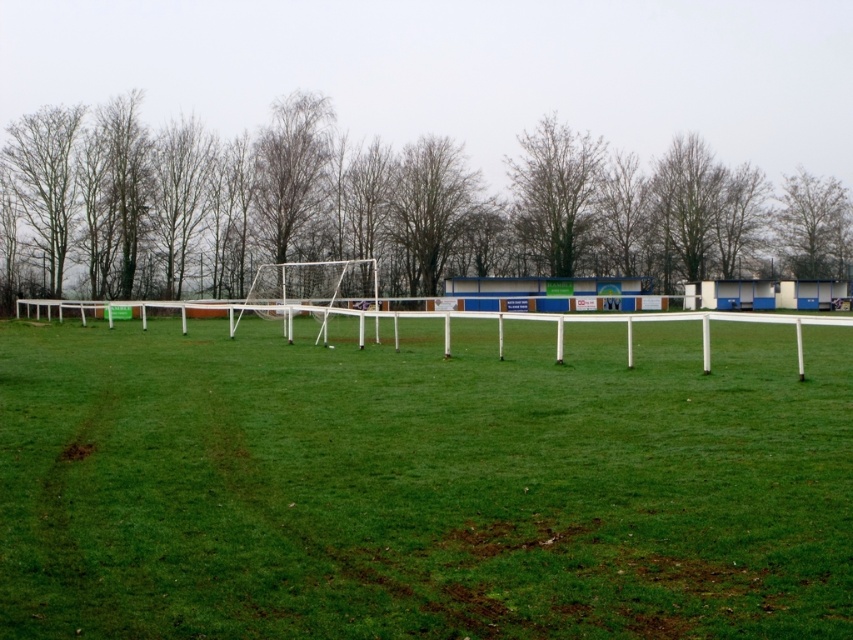
You are an architect designing a new sports field and want to incorporate the existing brown leafless tree at upper left and bare branches at upper right into the design. Which of the two should you prioritize preserving due to its size?

The brown leafless tree at upper left should be prioritized for preservation because its width is larger than the bare branches at upper right.

You are standing at the center of the soccer field and see a point marked at coordinates (383,209). Based on the scene description, what object is located at this point?

The point at coordinates (383,209) is located on a brown leafless tree at upper left.

You are standing at the edge of the sports field and want to walk to both the point labeled as point [247,179] and point [521,230]. Which point will you reach first if you walk straight towards them?

You will reach point [247,179] first because it is closer to you than point [521,230].